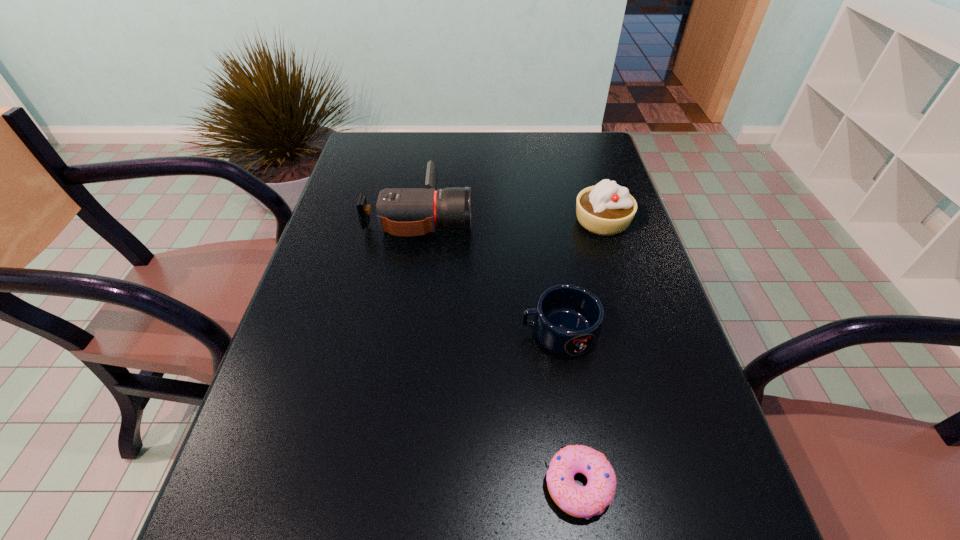
Find the location of a particular element. the leftmost object is located at coordinates (400, 211).

This screenshot has width=960, height=540. In order to click on the rightmost object in this screenshot , I will do `click(606, 209)`.

The image size is (960, 540). In order to click on the second shortest object in this screenshot , I will do `click(568, 319)`.

The height and width of the screenshot is (540, 960). I want to click on the third farthest object, so click(x=568, y=319).

The image size is (960, 540). Identify the location of doughnut. (579, 501).

Find the location of a particular element. the nearest object is located at coordinates (579, 501).

At what (x,y) coordinates should I click in order to perform the action: click on blank area located on the lens of the leftmost object. Please return your answer as a coordinate pair (x, y). Looking at the image, I should click on click(x=568, y=216).

Find the location of a particular element. The height and width of the screenshot is (540, 960). vacant area situated 0.350m on the front of the whipped cream is located at coordinates (643, 357).

You are a GUI agent. You are given a task and a screenshot of the screen. Output one action in this format:
    pyautogui.click(x=<x>, y=<y>)
    Task: Click on the vacant point located with the handle on the side of the mug
    
    Given the screenshot: What is the action you would take?
    [x=374, y=332]

At what (x,y) coordinates should I click in order to perform the action: click on free space located 0.120m with the handle on the side of the mug. Please return your answer as a coordinate pair (x, y). The image size is (960, 540). Looking at the image, I should click on (462, 332).